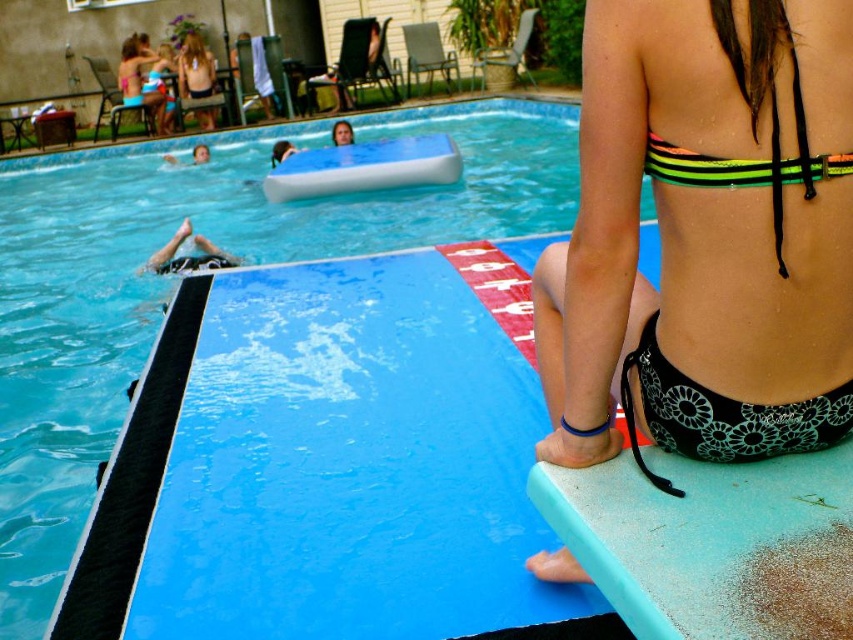
You are a guest at a backyard pool party and want to know which object is taller between the blue rubber pool at upper center and the black floral bikini at lower right. Can you tell me?

The blue rubber pool at upper center is taller than the black floral bikini at lower right according to the description.

You are a lifeguard at the pool and need to quickly reach the black floral bikini at lower right from the blue rubber pool at upper center. Can you make it in one stride? Explain your reasoning.

The blue rubber pool at upper center and the black floral bikini at lower right are 9.44 feet apart from each other. Since the average stride length for an adult is about 2.5 to 3 feet, covering 9.44 feet would require approximately 3 to 4 strides. Therefore, it would not be possible to reach the black floral bikini at lower right in a single stride from the blue rubber pool at upper center.

You are standing at the edge of the pool and want to reach the point marked as point (743, 436). If your maximum reach without moving is 1.2 meters, can you touch that point?

The distance between you and point (743, 436) is 1.54 meters, which is beyond your maximum reach of 1.2 meters. You cannot touch the point without moving closer.